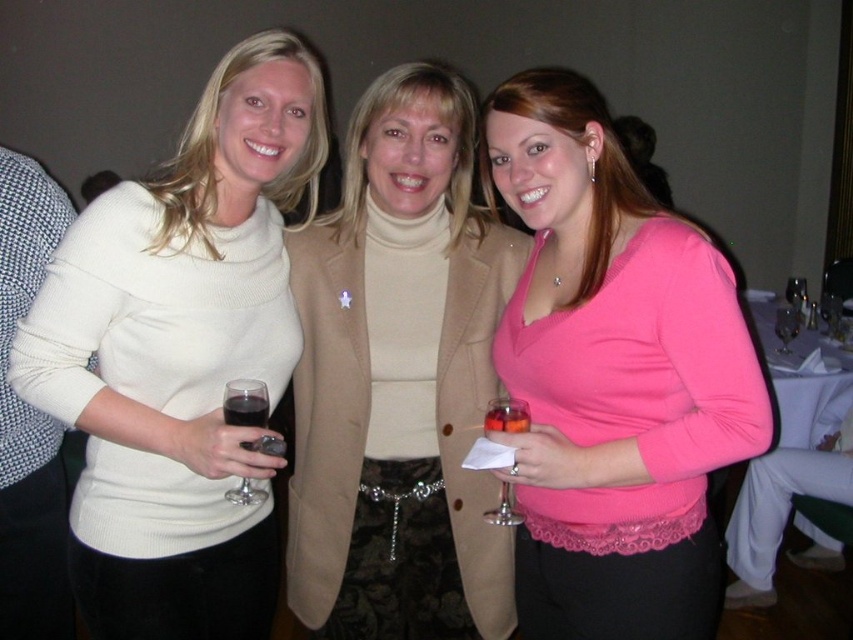
Where is `pink matte sweater at center`? This screenshot has width=853, height=640. pink matte sweater at center is located at coordinates (613, 378).

Which is more to the right, pink matte sweater at center or beige turtleneck sweater at center?

pink matte sweater at center

Who is more distant from viewer, [503,83] or [459,600]?

Positioned behind is point [459,600].

Find the location of `pink matte sweater at center`. pink matte sweater at center is located at coordinates (613, 378).

Measure the distance between translucent glass wine glass at center and camera.

translucent glass wine glass at center is 4.11 feet away from camera.

How distant is translucent glass wine glass at center from transparent plastic wine glass at center?

translucent glass wine glass at center is 2.08 meters from transparent plastic wine glass at center.

Where is `translucent glass wine glass at center`? The height and width of the screenshot is (640, 853). translucent glass wine glass at center is located at coordinates (506, 416).

Looking at this image, does beige turtleneck sweater at center appear on the right side of transparent plastic wine glass at center?

Incorrect, beige turtleneck sweater at center is not on the right side of transparent plastic wine glass at center.

Does point (381, 125) come behind point (776, 317)?

No, (381, 125) is in front of (776, 317).

The width and height of the screenshot is (853, 640). What are the coordinates of `beige turtleneck sweater at center` in the screenshot? It's located at [x=399, y=376].